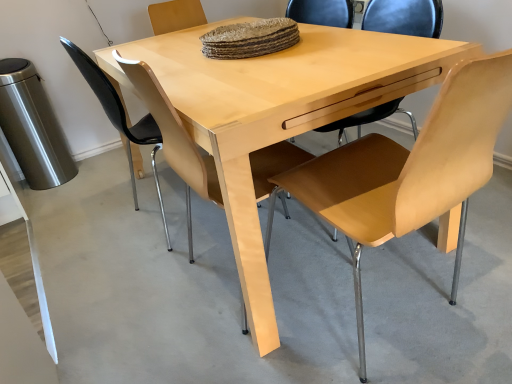
Where is `free location in front of light brown leather chair at center, the 3th chair viewed from the right`? This screenshot has width=512, height=384. free location in front of light brown leather chair at center, the 3th chair viewed from the right is located at coordinates (146, 280).